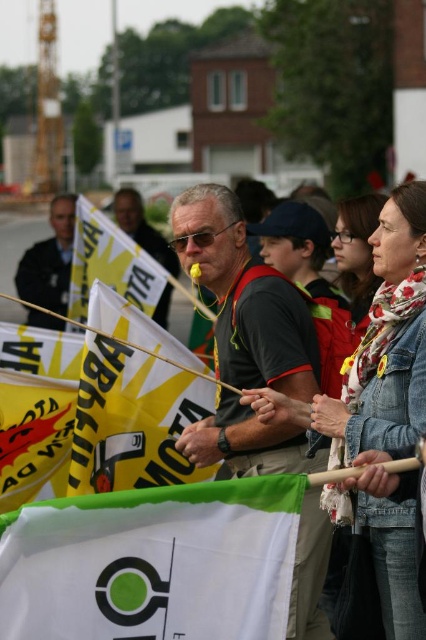
The width and height of the screenshot is (426, 640). What do you see at coordinates (134, 401) in the screenshot? I see `yellow/yellowish paper at center` at bounding box center [134, 401].

Can you confirm if yellow/yellowish paper at center is positioned below yellow fabric flag at lower left?

No, yellow/yellowish paper at center is not below yellow fabric flag at lower left.

Is point (124, 412) closer to viewer compared to point (16, 483)?

Yes, it is in front of point (16, 483).

The image size is (426, 640). Identify the location of yellow/yellowish paper at center. (134, 401).

Is matte black shirt at center taller than yellow/yellowish paper at center?

Correct, matte black shirt at center is much taller as yellow/yellowish paper at center.

Does point (244, 372) come in front of point (149, 435)?

Yes, it is.

Find the location of a particular element. This screenshot has height=640, width=426. matte black shirt at center is located at coordinates (245, 298).

Does white floral scarf at center have a greater height compared to yellow/yellowish paper at center?

Yes, white floral scarf at center is taller than yellow/yellowish paper at center.

Does white floral scarf at center have a greater width compared to yellow/yellowish paper at center?

No, white floral scarf at center is not wider than yellow/yellowish paper at center.

Who is more distant from viewer, (391, 531) or (94, 289)?

Point (94, 289)

At what (x,y) coordinates should I click in order to perform the action: click on white floral scarf at center. Please return your answer as a coordinate pair (x, y). This screenshot has width=426, height=640. Looking at the image, I should click on (388, 342).